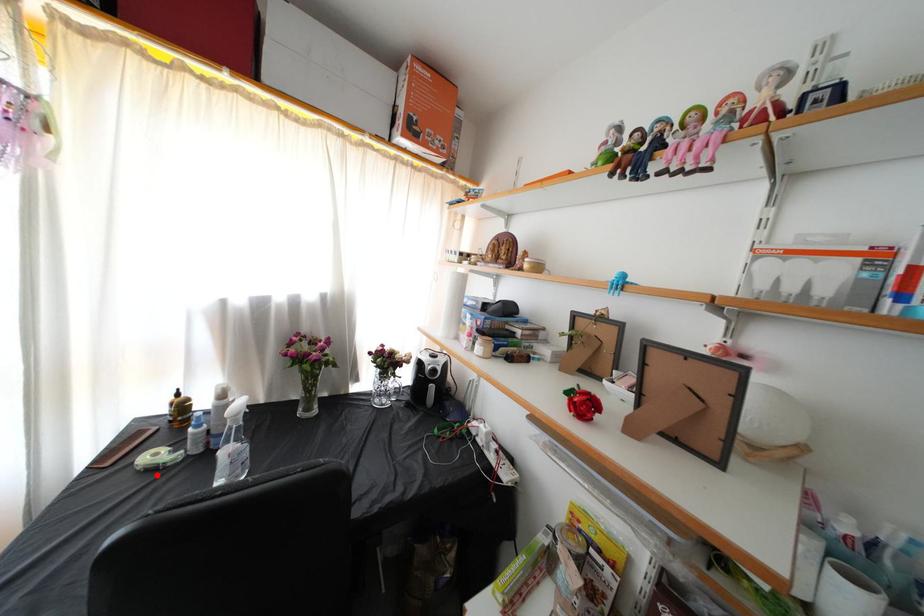
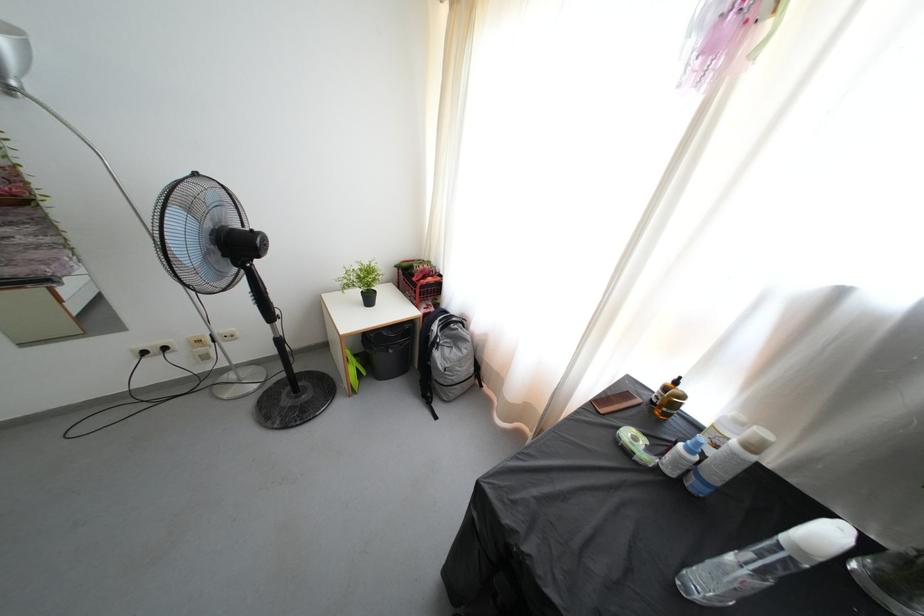
Where in the second image is the point corresponding to the highlighted location from the first image?

(631, 458)